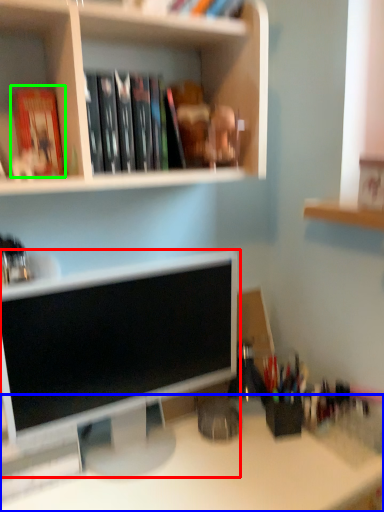
Question: Which object is the closest to the computer monitor (highlighted by a red box)? Choose among these: desk (highlighted by a blue box) or paperback book (highlighted by a green box).

Choices:
 (A) desk
 (B) paperback book

Answer: (A)